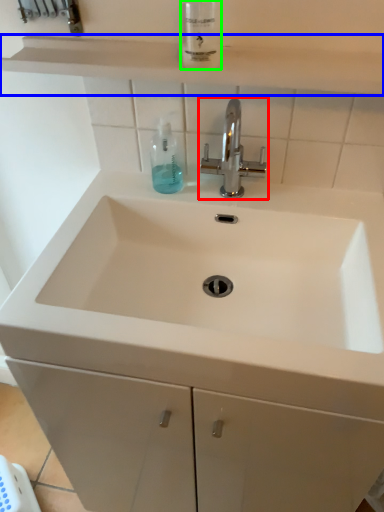
Question: Which object is the closest to the tap (highlighted by a red box)? Choose among these: shelve (highlighted by a blue box) or mouthwash (highlighted by a green box).

Choices:
 (A) shelve
 (B) mouthwash

Answer: (B)